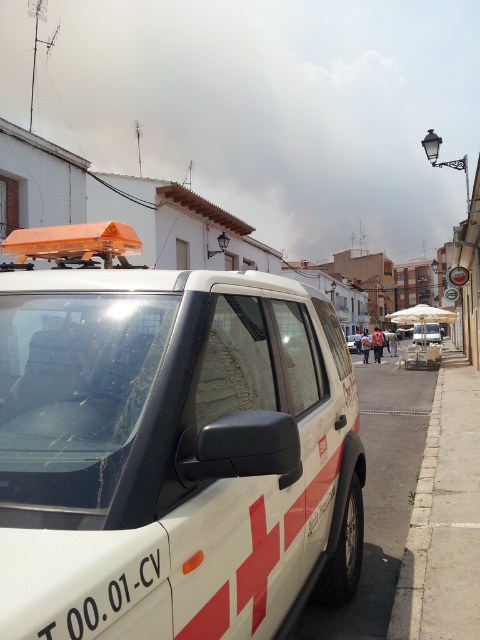
Question: Is white matte ambulance at center wider than white matte minivan at center?

Choices:
 (A) no
 (B) yes

Answer: (A)

Question: Among these points, which one is nearest to the camera?

Choices:
 (A) (324, 515)
 (B) (430, 339)

Answer: (A)

Question: Among these points, which one is nearest to the camera?

Choices:
 (A) (316, 509)
 (B) (354, 340)

Answer: (A)

Question: Can you confirm if gray concrete curb at lower right is wider than white matte minivan at center?

Choices:
 (A) yes
 (B) no

Answer: (B)

Question: Can you confirm if transparent glass windshield at center is wider than white plastic license plate at center?

Choices:
 (A) no
 (B) yes

Answer: (B)

Question: Which point is farther to the camera?

Choices:
 (A) (414, 556)
 (B) (355, 337)
 (C) (308, 522)
 (D) (296, 408)

Answer: (B)